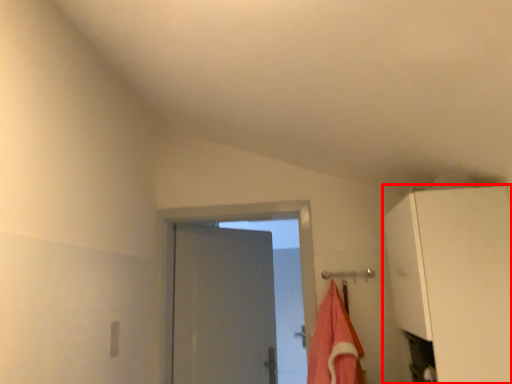
Question: In this image, where is cabinetry (annotated by the red box) located relative to beach towel?

Choices:
 (A) left
 (B) right

Answer: (B)